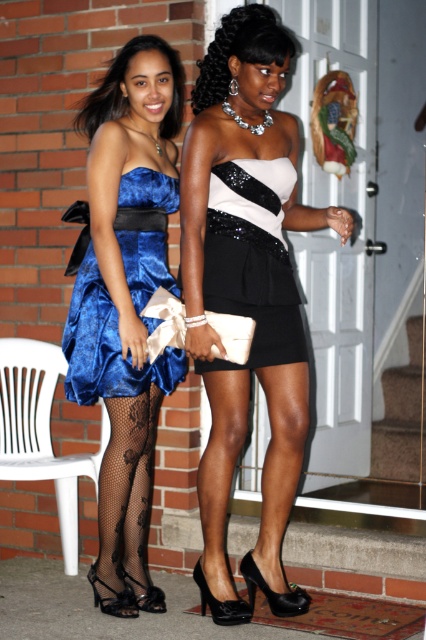
Can you confirm if black sequined dress at center is positioned below white plastic chair at lower left?

No.

Does black sequined dress at center have a greater width compared to white plastic chair at lower left?

In fact, black sequined dress at center might be narrower than white plastic chair at lower left.

I want to click on black sequined dress at center, so click(250, 266).

Can you confirm if velvet blue dress at left is thinner than white plastic chair at lower left?

Yes, velvet blue dress at left is thinner than white plastic chair at lower left.

Can you confirm if velvet blue dress at left is positioned to the left of white plastic chair at lower left?

No, velvet blue dress at left is not to the left of white plastic chair at lower left.

I want to click on velvet blue dress at left, so click(x=124, y=300).

Is black lace tights at lower left above satin dress at center?

Incorrect, black lace tights at lower left is not positioned above satin dress at center.

Is black lace tights at lower left thinner than satin dress at center?

Yes.

Is point (108, 602) positioned in front of point (224, 16)?

No, it is behind (224, 16).

Image resolution: width=426 pixels, height=640 pixels. I want to click on black lace tights at lower left, so click(126, 506).